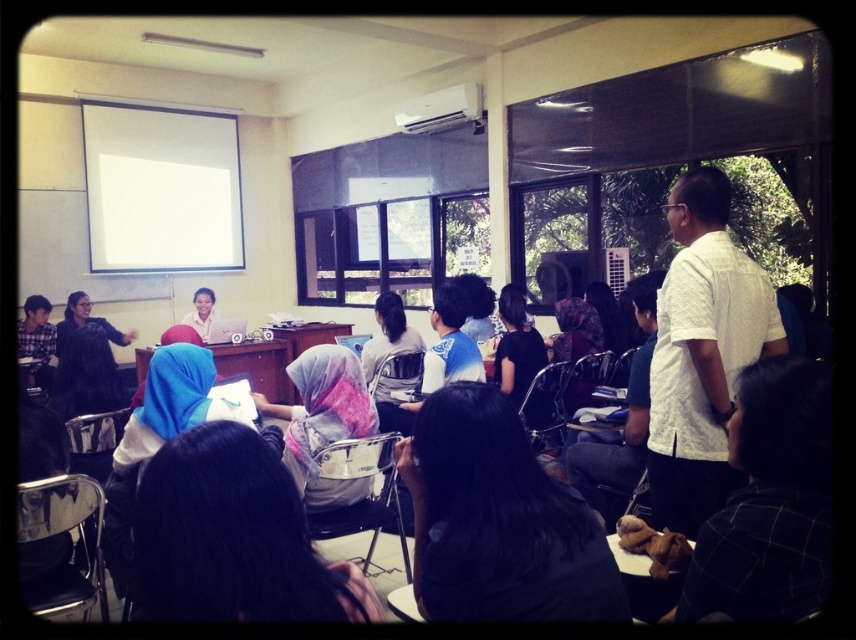
Question: Can you confirm if black fabric headscarf at center is positioned to the right of white textured shirt at right?

Choices:
 (A) yes
 (B) no

Answer: (B)

Question: Is black fabric headscarf at center to the left of white textured shirt at right from the viewer's perspective?

Choices:
 (A) yes
 (B) no

Answer: (A)

Question: Which object is the farthest from the black fabric headscarf at center?

Choices:
 (A) white textured shirt at right
 (B) matte white shirt at center

Answer: (B)

Question: Is the position of black fabric headscarf at center less distant than that of white textured shirt at right?

Choices:
 (A) yes
 (B) no

Answer: (A)

Question: Based on their relative distances, which object is farther from the black fabric headscarf at center?

Choices:
 (A) white textured shirt at right
 (B) matte white shirt at center

Answer: (B)

Question: Based on their relative distances, which object is farther from the white textured shirt at right?

Choices:
 (A) black fabric headscarf at center
 (B) matte white shirt at center

Answer: (B)